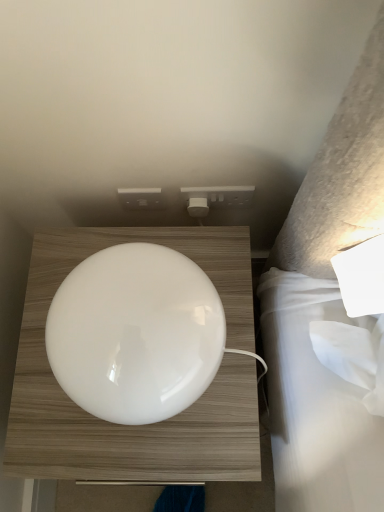
Question: Would you say white plastic socket at upper center is to the left or to the right of white glossy lampshade at center in the picture?

Choices:
 (A) right
 (B) left

Answer: (A)

Question: Which is correct: white plastic socket at upper center is inside white glossy lampshade at center, or outside of it?

Choices:
 (A) inside
 (B) outside

Answer: (B)

Question: From a real-world perspective, relative to white glossy lampshade at center, is white plastic socket at upper center vertically above or below?

Choices:
 (A) above
 (B) below

Answer: (A)

Question: Considering their positions, is white glossy lampshade at center located in front of or behind white plastic socket at upper center?

Choices:
 (A) front
 (B) behind

Answer: (A)

Question: In terms of size, does white glossy lampshade at center appear bigger or smaller than white plastic socket at upper center?

Choices:
 (A) big
 (B) small

Answer: (A)

Question: Looking at their shapes, would you say white glossy lampshade at center is wider or thinner than white plastic socket at upper center?

Choices:
 (A) wide
 (B) thin

Answer: (A)

Question: In terms of height, does white glossy lampshade at center look taller or shorter compared to white plastic socket at upper center?

Choices:
 (A) short
 (B) tall

Answer: (B)